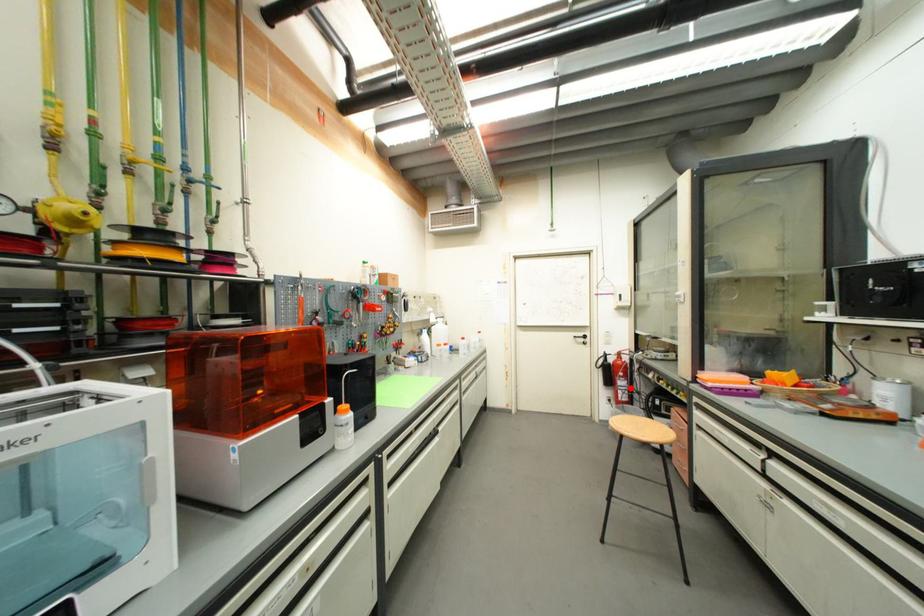
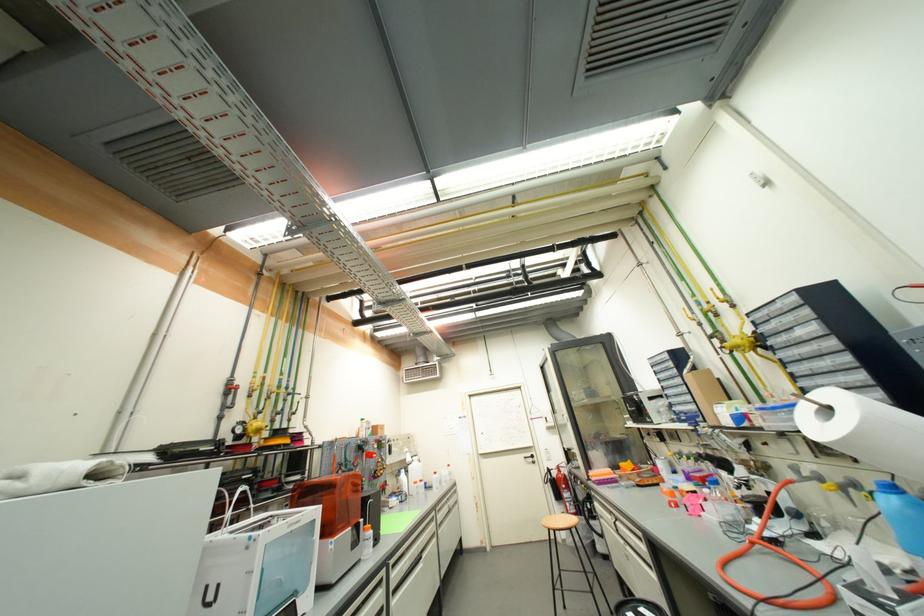
Question: I am providing you with two images of the same scene from different viewpoints. A red point is marked on the first image. At the location where the point appears in image 1, is it still visible in image 2?

Choices:
 (A) Yes
 (B) No

Answer: (A)